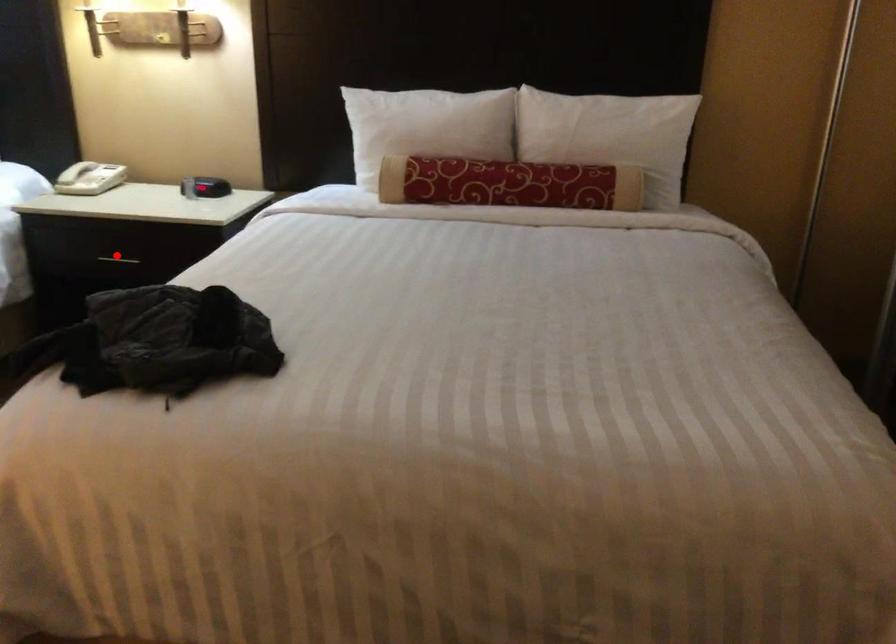
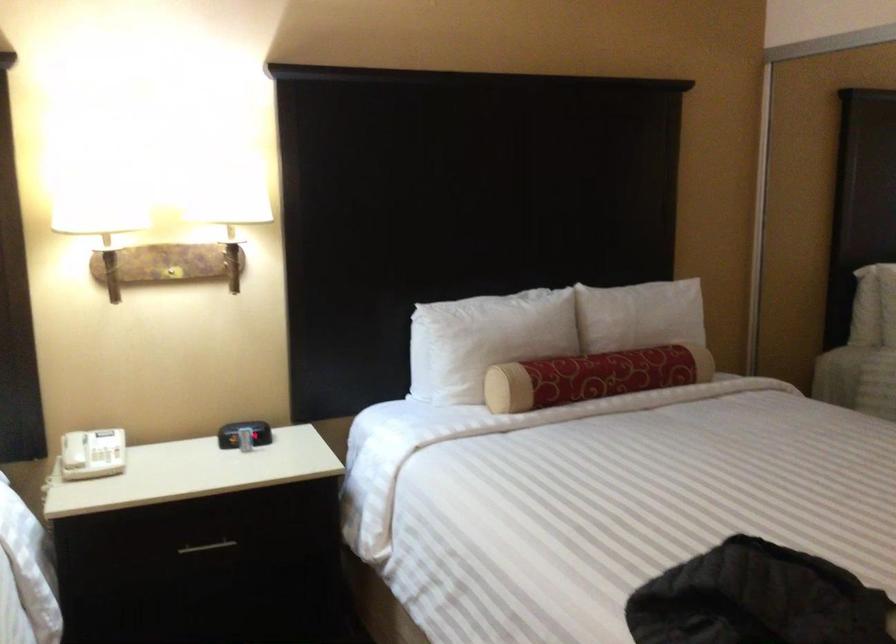
Where in the second image is the point corresponding to the highlighted location from the first image?

(207, 547)